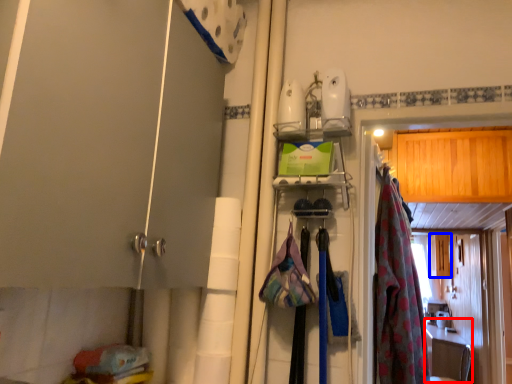
Question: Which point is further to the camera, counter top (highlighted by a red box) or cabinetry (highlighted by a blue box)?

Choices:
 (A) counter top
 (B) cabinetry

Answer: (B)